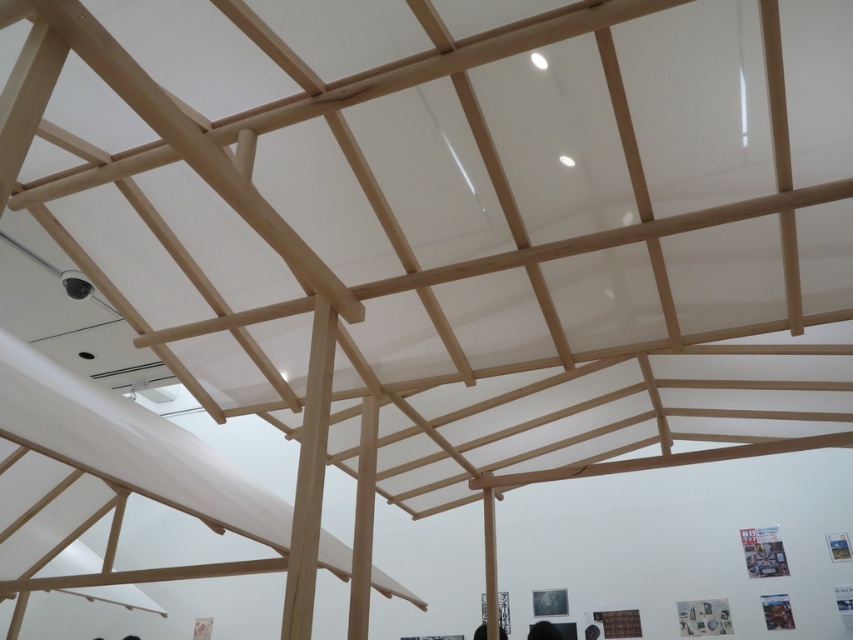
The image size is (853, 640). Identify the location of black hair at lower center. (543, 630).

Measure the distance between point (554, 637) and camera.

Point (554, 637) and camera are 4.75 meters apart.

Image resolution: width=853 pixels, height=640 pixels. In order to click on black hair at lower center in this screenshot , I will do `click(543, 630)`.